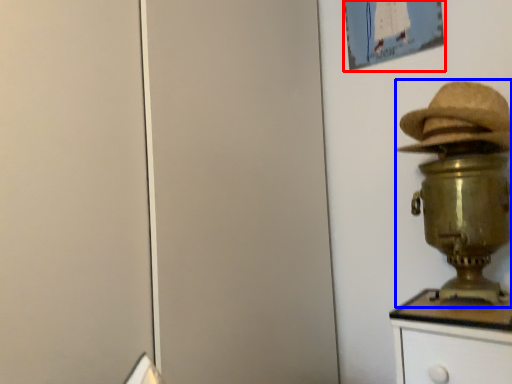
Question: Among these objects, which one is farthest to the camera, picture frame (highlighted by a red box) or table lamp (highlighted by a blue box)?

Choices:
 (A) picture frame
 (B) table lamp

Answer: (A)